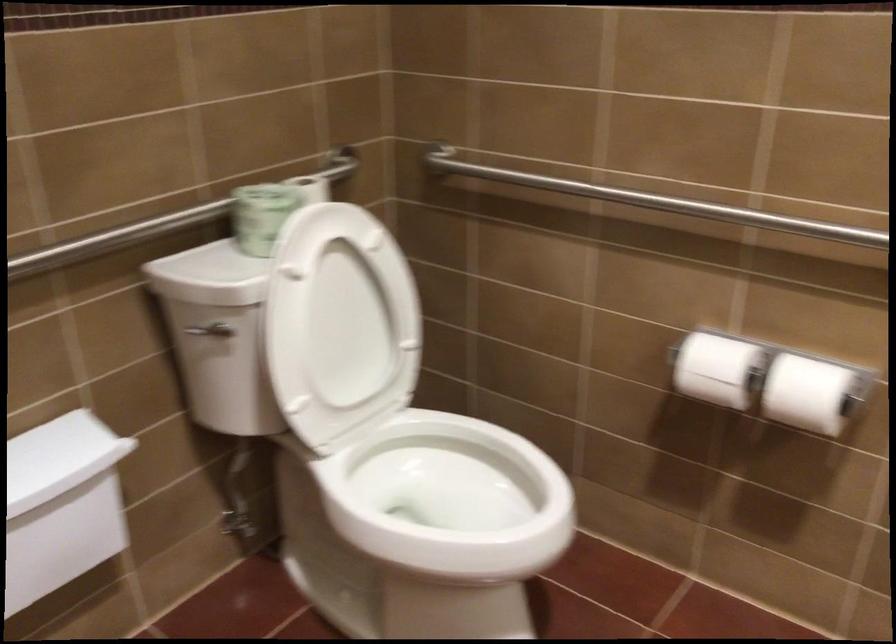
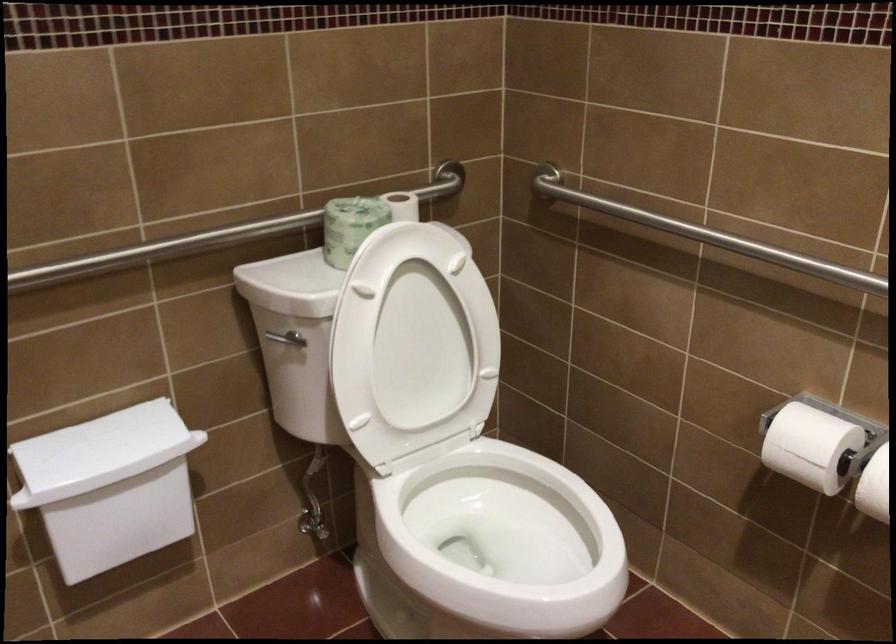
Locate, in the second image, the point that corresponds to [719,371] in the first image.

(810, 446)